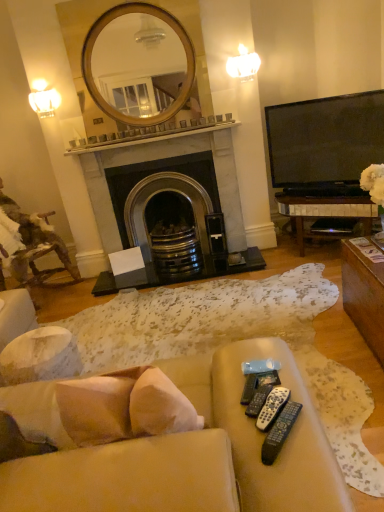
Question: Relative to black marble fireplace at center, is black plastic remote control at lower center, placed as the 3th remote control when sorted from front to back, in front or behind?

Choices:
 (A) behind
 (B) front

Answer: (B)

Question: Which is correct: black plastic remote control at lower center, the second remote control in the back-to-front sequence, is inside black marble fireplace at center, or outside of it?

Choices:
 (A) inside
 (B) outside

Answer: (B)

Question: Which object is positioned closest to the black plastic remote control at lower center, placed as the 3th remote control when sorted from front to back?

Choices:
 (A) black plastic remote controls at lower right, placed as the fourth remote control when sorted from back to front
 (B) white frosted glass sconce at upper right, placed as the second light fixture when sorted from left to right
 (C) camouflage fabric chair at left
 (D) matte white lampshade at upper left, the second light fixture in the top-to-bottom sequence
 (E) white marble fireplace at center

Answer: (A)

Question: Which is nearer to the white frosted glass sconce at upper right, which is the 2th light fixture in bottom-to-top order?

Choices:
 (A) black plastic remote control at lower center, marked as the fourth remote control in a front-to-back arrangement
 (B) black plastic remote controls at lower right, placed as the fourth remote control when sorted from back to front
 (C) camouflage fabric chair at left
 (D) white marble fireplace at center
 (E) beige fabric couch at lower center

Answer: (D)